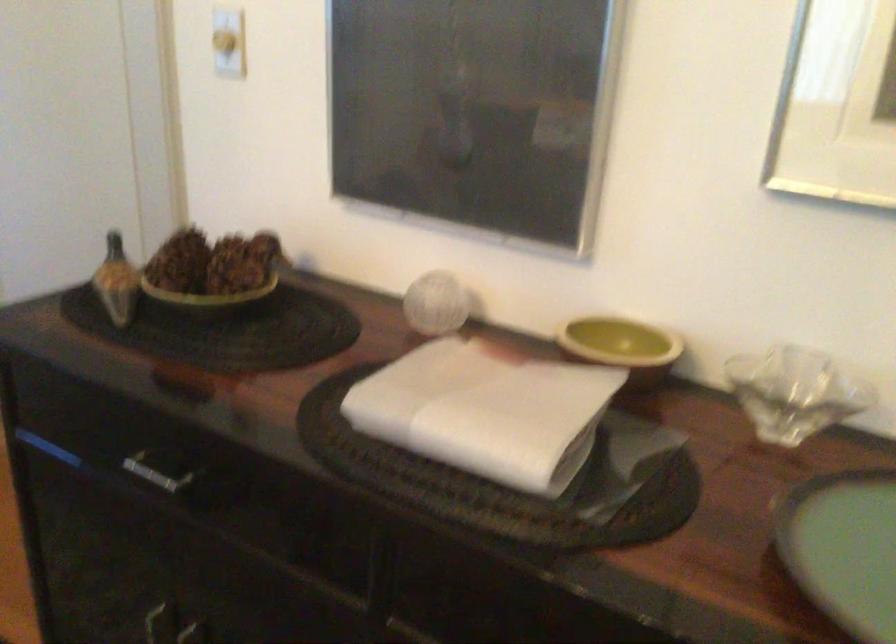
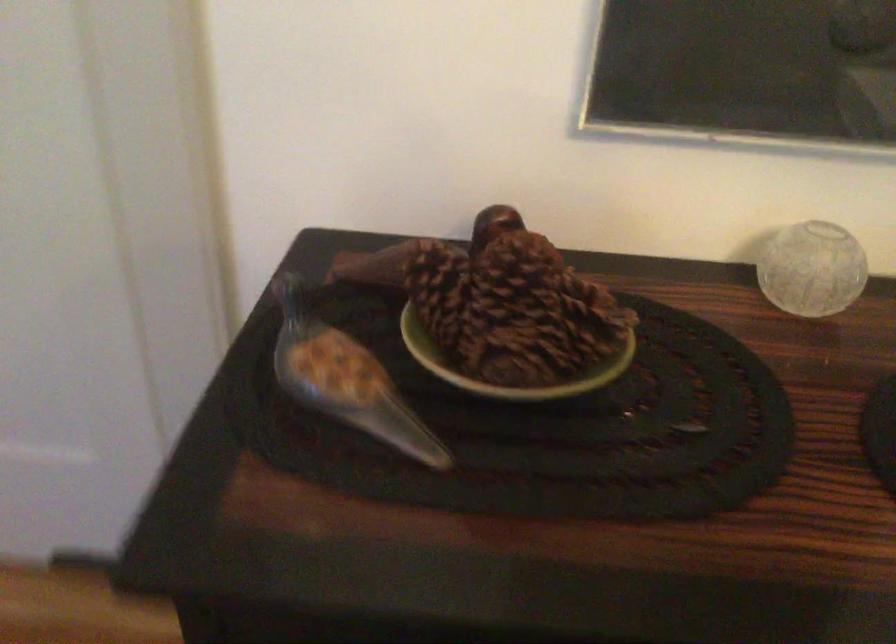
Question: Based on the continuous images, in which direction is the camera rotating? Reply with the corresponding letter.

Choices:
 (A) Left
 (B) Right
 (C) Up
 (D) Down

Answer: (B)